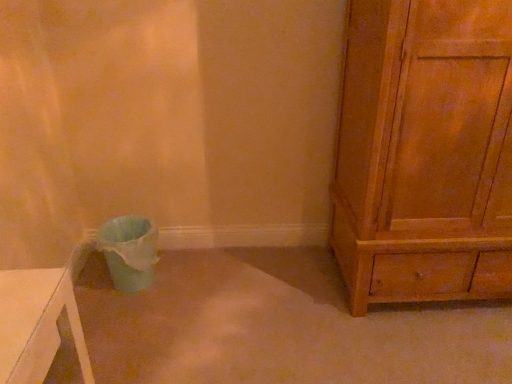
Question: Is matte plastic potty at lower left positioned before wooden chest of drawers at right?

Choices:
 (A) yes
 (B) no

Answer: (B)

Question: Is matte plastic potty at lower left shorter than wooden chest of drawers at right?

Choices:
 (A) no
 (B) yes

Answer: (B)

Question: Is matte plastic potty at lower left at the right side of wooden chest of drawers at right?

Choices:
 (A) no
 (B) yes

Answer: (A)

Question: Is matte plastic potty at lower left behind wooden chest of drawers at right?

Choices:
 (A) no
 (B) yes

Answer: (B)

Question: Is matte plastic potty at lower left directly adjacent to wooden chest of drawers at right?

Choices:
 (A) yes
 (B) no

Answer: (B)

Question: Is matte plastic potty at lower left far from wooden chest of drawers at right?

Choices:
 (A) yes
 (B) no

Answer: (A)

Question: Considering the relative sizes of wooden chest of drawers at right and matte plastic potty at lower left in the image provided, is wooden chest of drawers at right thinner than matte plastic potty at lower left?

Choices:
 (A) yes
 (B) no

Answer: (B)

Question: Is wooden chest of drawers at right directly adjacent to matte plastic potty at lower left?

Choices:
 (A) yes
 (B) no

Answer: (B)

Question: Is wooden chest of drawers at right far from matte plastic potty at lower left?

Choices:
 (A) no
 (B) yes

Answer: (B)

Question: Is wooden chest of drawers at right outside of matte plastic potty at lower left?

Choices:
 (A) no
 (B) yes

Answer: (B)

Question: Considering the relative positions of wooden chest of drawers at right and matte plastic potty at lower left in the image provided, is wooden chest of drawers at right to the left of matte plastic potty at lower left from the viewer's perspective?

Choices:
 (A) yes
 (B) no

Answer: (B)

Question: Is wooden chest of drawers at right turned away from matte plastic potty at lower left?

Choices:
 (A) yes
 (B) no

Answer: (B)

Question: From a real-world perspective, is matte plastic potty at lower left positioned above or below wooden chest of drawers at right?

Choices:
 (A) above
 (B) below

Answer: (B)